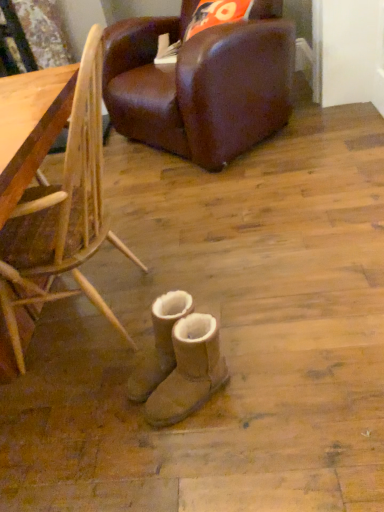
At what (x,y) coordinates should I click in order to perform the action: click on vacant space situated above tan suede boots at center, positioned as the first footwear in front-to-back order (from a real-world perspective). Please return your answer as a coordinate pair (x, y). This screenshot has width=384, height=512. Looking at the image, I should click on click(193, 331).